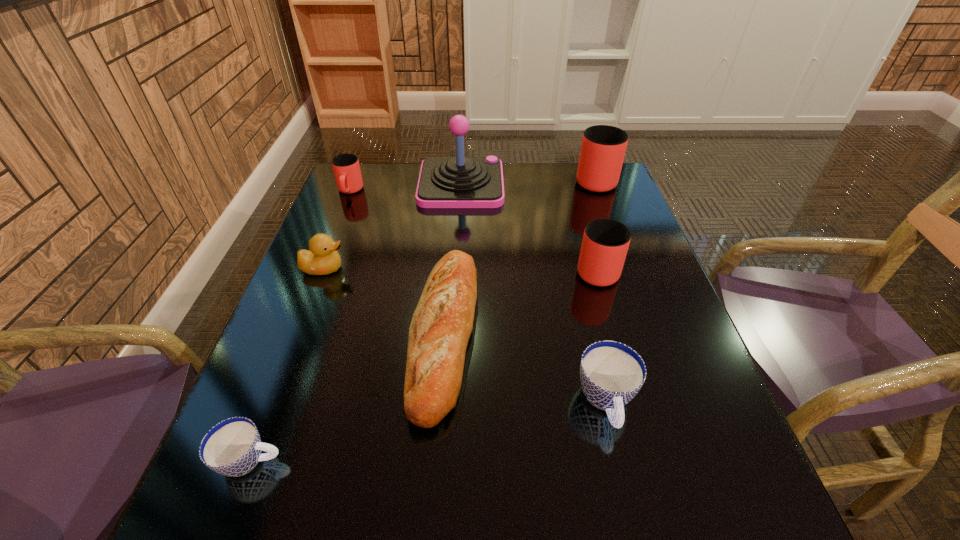
At what (x,y) coordinates should I click in order to perform the action: click on free space located 0.280m on the side of the shortest object with the handle. Please return your answer as a coordinate pair (x, y). Looking at the image, I should click on (456, 461).

Find the location of a particular element. Image resolution: width=960 pixels, height=540 pixels. joystick that is at the far edge is located at coordinates (444, 182).

I want to click on duckling positioned at the left edge, so click(323, 259).

Image resolution: width=960 pixels, height=540 pixels. Find the location of `object that is at the far left corner`. object that is at the far left corner is located at coordinates (346, 167).

You are a GUI agent. You are given a task and a screenshot of the screen. Output one action in this format:
    pyautogui.click(x=<x>, y=<y>)
    Task: Click on the object located in the far right corner section of the desktop
    
    Given the screenshot: What is the action you would take?
    pyautogui.click(x=603, y=147)

Identify the location of free space at the far edge of the desktop. (554, 164).

Identify the location of vacant point at the left edge. (276, 485).

The width and height of the screenshot is (960, 540). In order to click on vacant space at the right edge of the desktop in this screenshot , I will do `click(637, 297)`.

In the image, there is a desktop. Identify the location of vacant space at the far left corner. (367, 164).

Locate an element on the screen. This screenshot has height=540, width=960. free space between the left blue cup and the smallest pink cup is located at coordinates (300, 326).